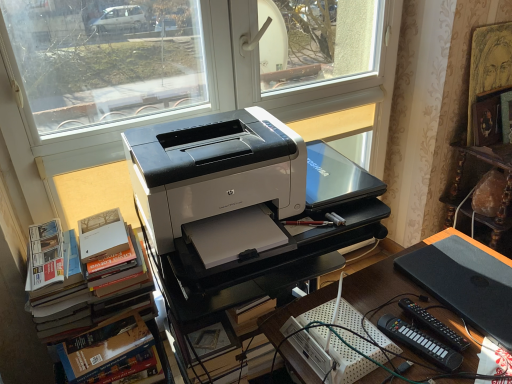
Question: From the image's perspective, is black plastic desk at center above or below white plastic printer at center?

Choices:
 (A) below
 (B) above

Answer: (A)

Question: Is black plastic desk at center spatially inside white plastic printer at center, or outside of it?

Choices:
 (A) outside
 (B) inside

Answer: (A)

Question: Estimate the real-world distances between objects in this image. Which object is closer to the hardcover books at left?

Choices:
 (A) black plastic desk at center
 (B) white plastic printer at center
 (C) white glossy printer at center
 (D) wooden bookshelf at right
 (E) black matte laptop at lower right

Answer: (C)

Question: Estimate the real-world distances between objects in this image. Which object is closer to the black matte laptop at lower right?

Choices:
 (A) black plastic remote control at lower right, which ranks as the 2th equipment in left-to-right order
 (B) white plastic printer at center
 (C) wooden bookshelf at right
 (D) hardcover books at left
 (E) black plastic remote control at lower right, positioned as the second equipment in right-to-left order

Answer: (A)